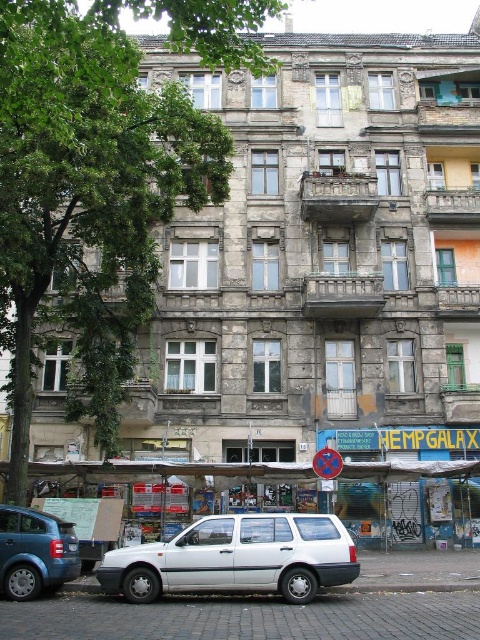
Question: Which of these objects is positioned closest to the metallic reflective sign at center?

Choices:
 (A) white matte car at center
 (B) blue matte hatchback at lower left

Answer: (A)

Question: Is blue matte hatchback at lower left positioned at the back of white plastic license plate at center?

Choices:
 (A) no
 (B) yes

Answer: (A)

Question: Which point is closer to the camera?

Choices:
 (A) [x=335, y=476]
 (B) [x=0, y=573]
 (C) [x=180, y=589]

Answer: (C)

Question: Does metallic reflective sign at center appear on the right side of white plastic license plate at center?

Choices:
 (A) yes
 (B) no

Answer: (A)

Question: Among these points, which one is farthest from the camera?

Choices:
 (A) (332, 458)
 (B) (310, 570)

Answer: (A)

Question: Can you confirm if blue matte hatchback at lower left is positioned above metallic reflective sign at center?

Choices:
 (A) yes
 (B) no

Answer: (B)